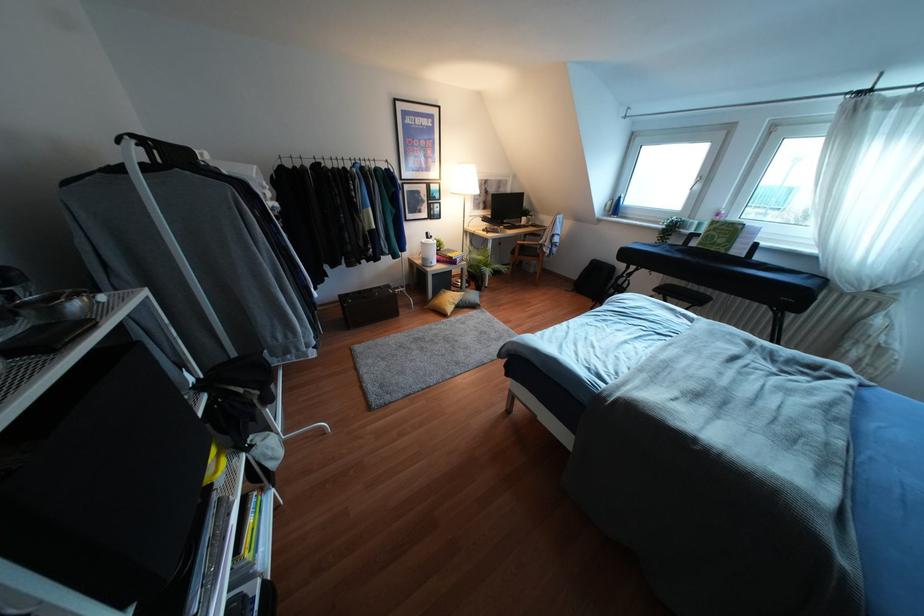
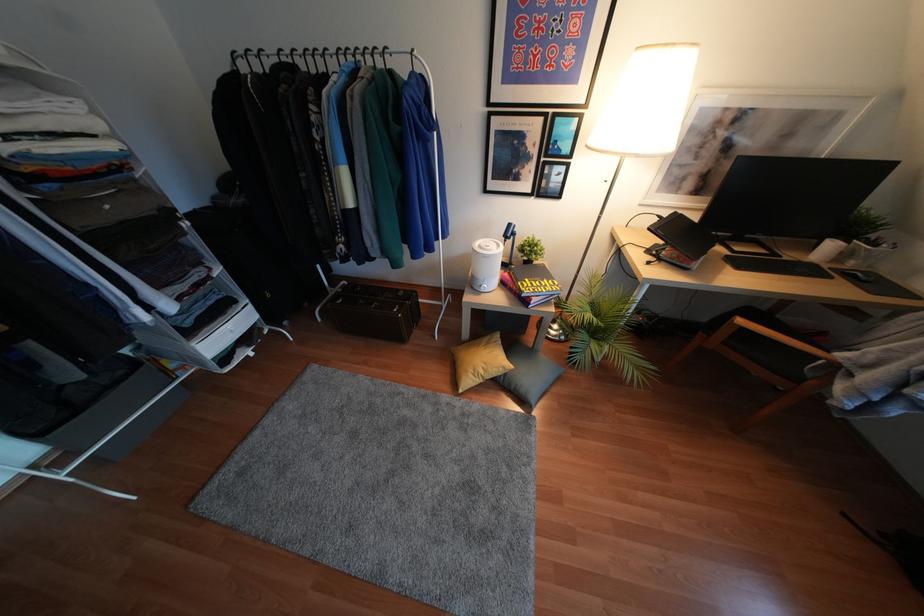
In the second image, find the point that corresponds to pixel 444 320 in the first image.

(445, 397)